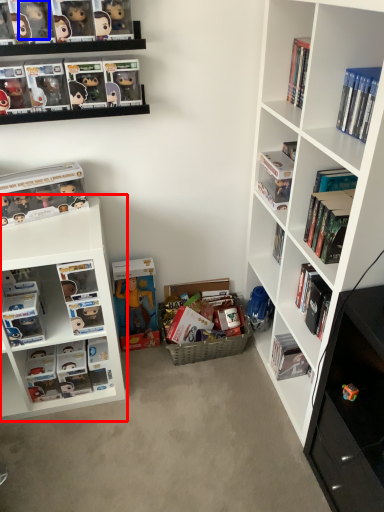
Question: Which of the following is the closest to the observer, bookshelf (highlighted by a red box) or toy (highlighted by a blue box)?

Choices:
 (A) bookshelf
 (B) toy

Answer: (B)